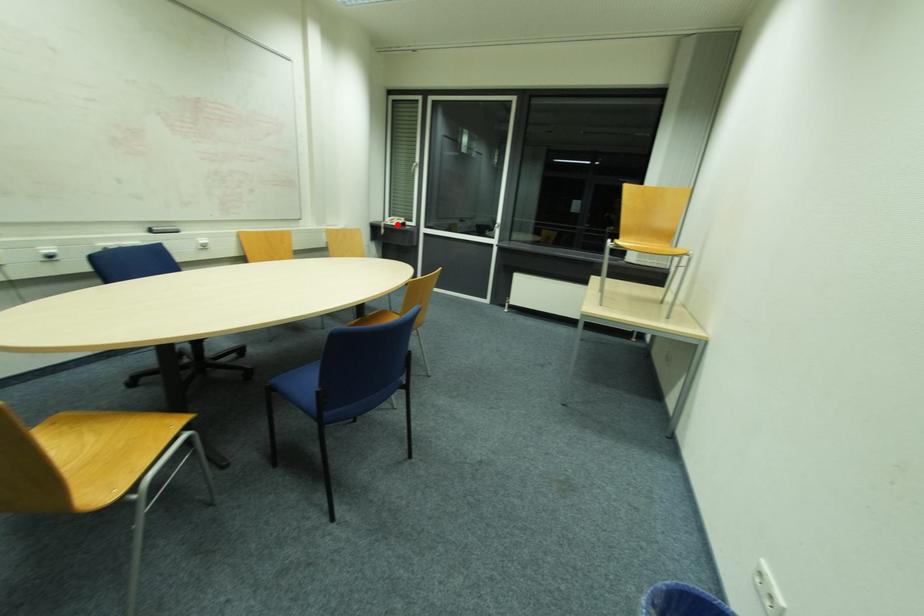
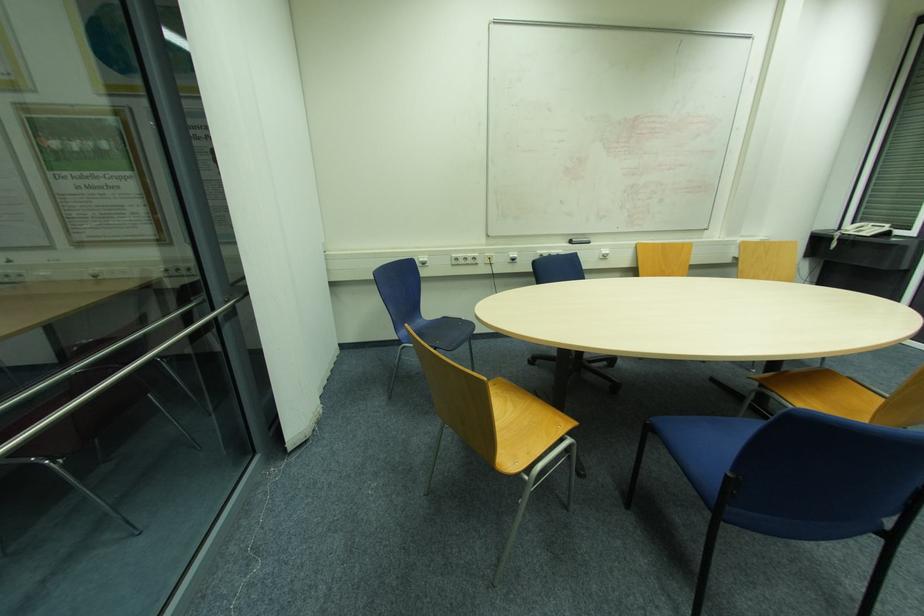
Question: I am providing you with two images of the same scene from different viewpoints. In image1, a red point is highlighted. Considering the same 3D point in image2, which of the following is correct?

Choices:
 (A) It is closer
 (B) It is farther

Answer: (B)